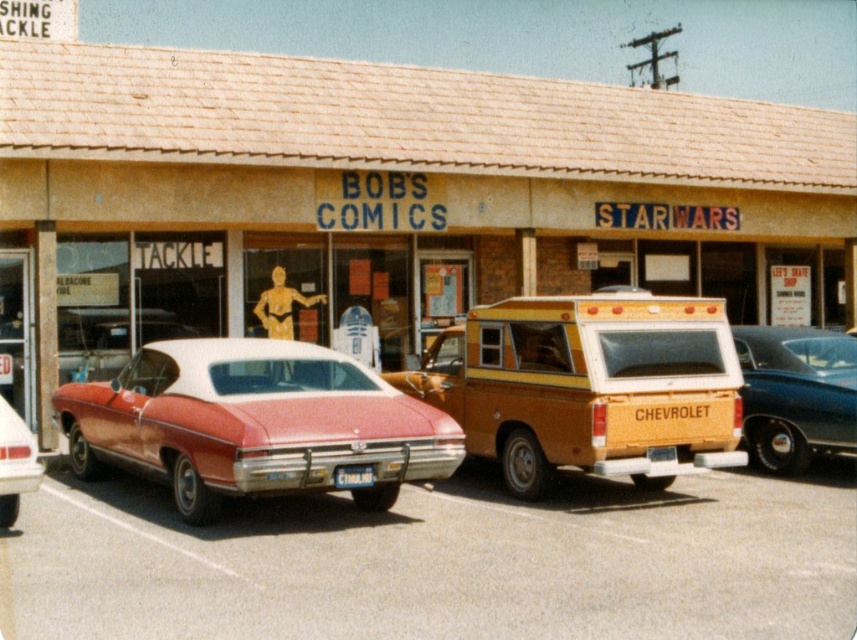
You are a delivery person who needs to park your vehicle between the matte yellow truck at center and the matte red car at center. Your delivery van is 2 meters wide. Can you fit your van between them?

The matte yellow truck at center is wider than the matte red car at center, but the exact distance between them isn

You are a delivery person who needs to unload a package from the matte yellow truck at center to the matte red car at center. Can you do so without tilting the package?

The matte yellow truck at center is taller than the matte red car at center, so the package can be unloaded without tilting as long as its height does not exceed the height of the matte red car at center.

You are a delivery person who needs to load a large package that requires a minimum clearance of 1.8 meters. You have access to both the wooden paneling camper van at center and the matte red car at center. Which vehicle should you choose to ensure the package fits?

The wooden paneling camper van at center has a greater height compared to the matte red car at center, so you should choose the wooden paneling camper van at center to ensure the package fits as it meets the minimum clearance requirement.